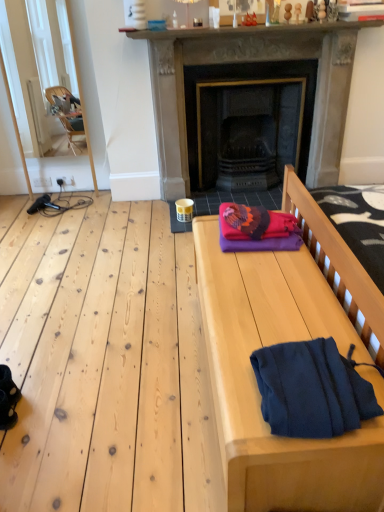
Find the location of a particular element. The height and width of the screenshot is (512, 384). free space above smooth wooden bench at right (from a real-world perspective) is located at coordinates (256, 296).